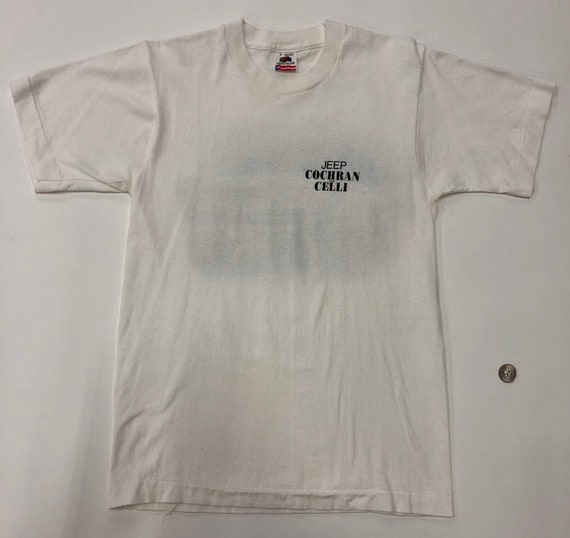
The height and width of the screenshot is (538, 570). What are the coordinates of `corner` in the screenshot? It's located at (551, 523), (12, 523), (13, 27), (556, 16).